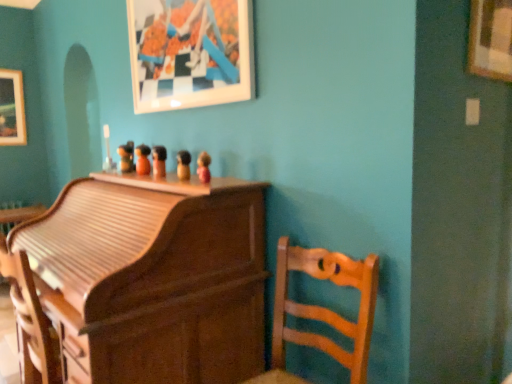
Identify the location of unoccupied area in front of wooden figurine at center, the 1th toy when ordered from left to right. The height and width of the screenshot is (384, 512). (119, 175).